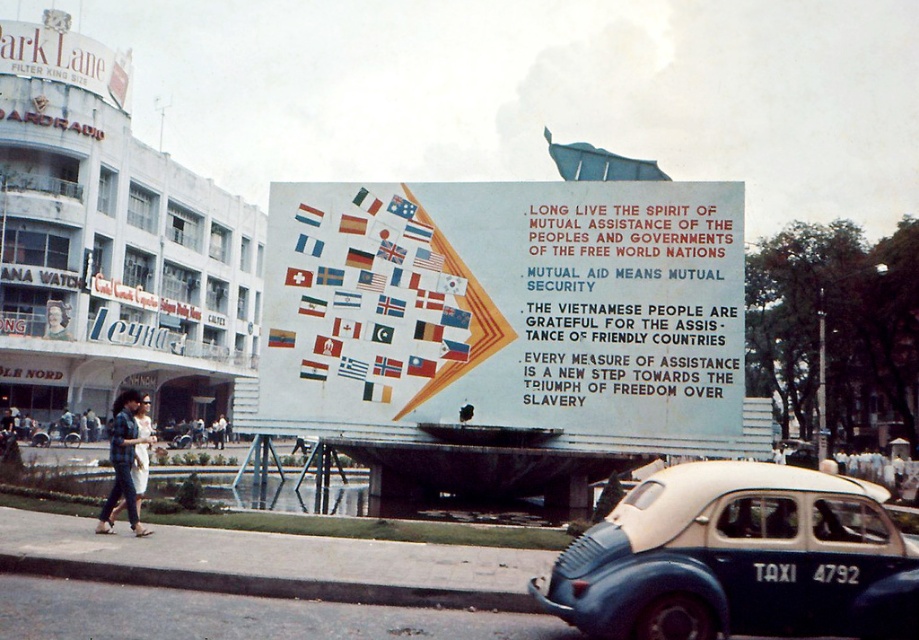
You are a pedestrian standing at the center of the scene. You need to cross the street to reach the plaid shirt at lower left. However, there is a blue matte taxi cab at lower right in your path. Can you safely walk around the taxi without going into the street?

The blue matte taxi cab at lower right is positioned under the plaid shirt at lower left, meaning the taxi is closer to you than the shirt. To reach the plaid shirt at lower left, you would need to walk around the taxi, but since it is under the shirt, the shirt is elevated or above the taxi. However, since you are on the ground level, you can safely walk around the taxi on the sidewalk without entering the street.

You are a drone operator trying to navigate between two points in the urban scene. You need to fly from point A to point B. If point A is at point (x=722, y=196) and point B is at point (x=142, y=440), will you be able to fly directly between them without any obstruction?

Point (x=722, y=196) is behind point (x=142, y=440), so you will not be able to fly directly between them without obstruction.

You are a photographer standing at the edge of the street. You want to take a photo of the white painted billboard at center and the blue matte taxi cab at lower right in the same frame. The minimum distance between the two objects to be in focus is 8 meters. Will you be able to capture both in focus?

The white painted billboard at center and the blue matte taxi cab at lower right are 8.28 meters apart from each other. Since the minimum distance required is 8 meters, the photographer can capture both in focus as the distance between them exceeds the required minimum.